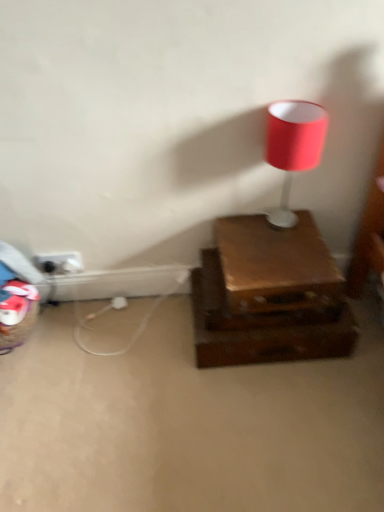
Question: From a real-world perspective, relative to shiny brown drawer at center, is matte red lampshade at upper right vertically above or below?

Choices:
 (A) below
 (B) above

Answer: (B)

Question: Considering the positions of matte red lampshade at upper right and shiny brown drawer at center in the image, is matte red lampshade at upper right wider or thinner than shiny brown drawer at center?

Choices:
 (A) thin
 (B) wide

Answer: (A)

Question: Which object is the closest to the black plastic outlet at lower left?

Choices:
 (A) shiny brown drawer at center
 (B) matte red lampshade at upper right

Answer: (A)

Question: Which of these objects is positioned farthest from the shiny brown drawer at center?

Choices:
 (A) matte red lampshade at upper right
 (B) black plastic outlet at lower left

Answer: (B)